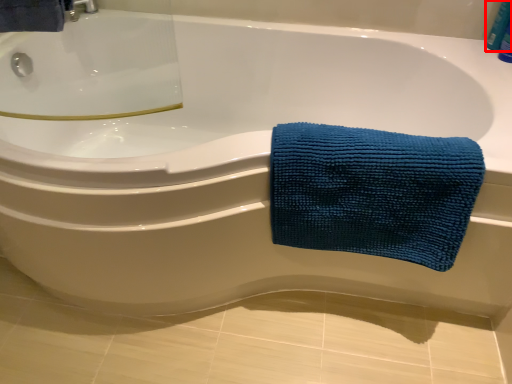
Question: From the image's perspective, what is the correct spatial positioning of toiletry (annotated by the red box) in reference to towel?

Choices:
 (A) above
 (B) below

Answer: (A)